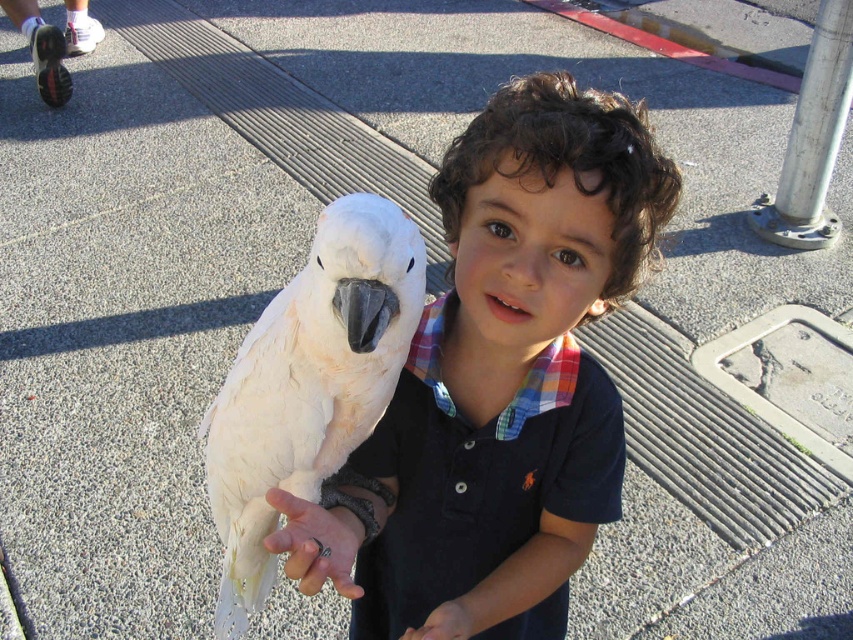
Question: Among these points, which one is nearest to the camera?

Choices:
 (A) (573, 397)
 (B) (476, 116)

Answer: (B)

Question: Can you confirm if white matte hand at center is positioned to the left of white matte hand at lower center?

Choices:
 (A) yes
 (B) no

Answer: (A)

Question: Among these objects, which one is nearest to the camera?

Choices:
 (A) white matte hand at lower center
 (B) white feathered bird at upper left
 (C) white matte hand at center
 (D) matte blue shirt at center

Answer: (C)

Question: Is the position of white feathered parrot at center more distant than that of white matte hand at lower center?

Choices:
 (A) no
 (B) yes

Answer: (A)

Question: Considering the real-world distances, which object is closest to the matte blue shirt at center?

Choices:
 (A) white feathered bird at upper left
 (B) white feathered parrot at center

Answer: (A)

Question: Does white feathered parrot at center appear under matte blue shirt at center?

Choices:
 (A) no
 (B) yes

Answer: (A)